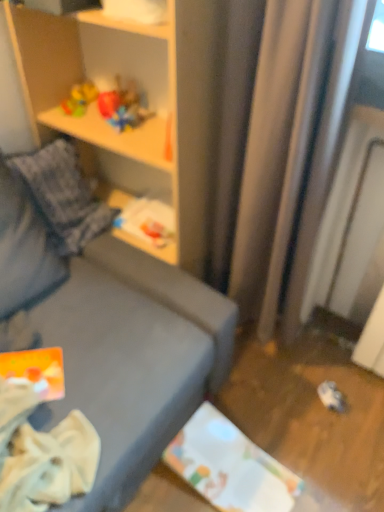
Question: Considering the relative positions of rubberized plastic toy at upper left and wooden shelf at upper left in the image provided, is rubberized plastic toy at upper left to the left of wooden shelf at upper left from the viewer's perspective?

Choices:
 (A) yes
 (B) no

Answer: (A)

Question: Considering the relative sizes of rubberized plastic toy at upper left and wooden shelf at upper left in the image provided, is rubberized plastic toy at upper left wider than wooden shelf at upper left?

Choices:
 (A) yes
 (B) no

Answer: (B)

Question: Does rubberized plastic toy at upper left have a greater height compared to wooden shelf at upper left?

Choices:
 (A) no
 (B) yes

Answer: (A)

Question: Can you confirm if rubberized plastic toy at upper left is thinner than wooden shelf at upper left?

Choices:
 (A) yes
 (B) no

Answer: (A)

Question: Is rubberized plastic toy at upper left outside wooden shelf at upper left?

Choices:
 (A) no
 (B) yes

Answer: (A)

Question: From a real-world perspective, does rubberized plastic toy at upper left sit lower than wooden shelf at upper left?

Choices:
 (A) yes
 (B) no

Answer: (B)

Question: Does wooden shelf at upper left have a smaller size compared to rubberized plastic toy at upper left?

Choices:
 (A) no
 (B) yes

Answer: (A)

Question: Considering the relative sizes of wooden shelf at upper left and rubberized plastic toy at upper left in the image provided, is wooden shelf at upper left shorter than rubberized plastic toy at upper left?

Choices:
 (A) no
 (B) yes

Answer: (A)

Question: Is wooden shelf at upper left completely or partially outside of rubberized plastic toy at upper left?

Choices:
 (A) no
 (B) yes

Answer: (B)

Question: Is wooden shelf at upper left at the right side of rubberized plastic toy at upper left?

Choices:
 (A) no
 (B) yes

Answer: (B)

Question: Would you consider wooden shelf at upper left to be distant from rubberized plastic toy at upper left?

Choices:
 (A) yes
 (B) no

Answer: (B)

Question: Considering the relative sizes of wooden shelf at upper left and rubberized plastic toy at upper left in the image provided, is wooden shelf at upper left bigger than rubberized plastic toy at upper left?

Choices:
 (A) no
 (B) yes

Answer: (B)

Question: Is wooden shelf at upper left in front of or behind rubberized plastic toy at upper left in the image?

Choices:
 (A) behind
 (B) front

Answer: (B)